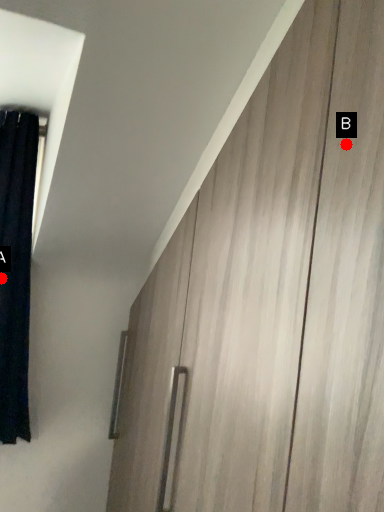
Question: Two points are circled on the image, labeled by A and B beside each circle. Which point is further to the camera?

Choices:
 (A) A is further
 (B) B is further

Answer: (A)